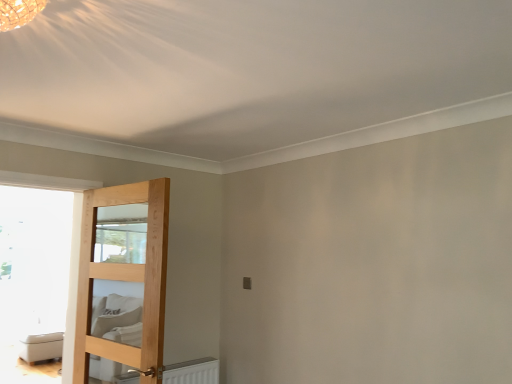
The image size is (512, 384). What are the coordinates of `white leather ottoman at lower left` in the screenshot? It's located at (41, 346).

From the picture: What is the approximate height of white leather ottoman at lower left?

20.52 inches.

Describe the element at coordinates (41, 346) in the screenshot. I see `white leather ottoman at lower left` at that location.

At what (x,y) coordinates should I click in order to perform the action: click on natural wood door at left. Please return your answer as a coordinate pair (x, y). Looking at the image, I should click on (122, 282).

This screenshot has width=512, height=384. What do you see at coordinates (122, 282) in the screenshot?
I see `natural wood door at left` at bounding box center [122, 282].

Identify the location of white leather ottoman at lower left. The width and height of the screenshot is (512, 384). (41, 346).

Is natural wood door at left to the left or to the right of white leather ottoman at lower left in the image?

Clearly, natural wood door at left is on the right of white leather ottoman at lower left in the image.

Which is behind, natural wood door at left or white leather ottoman at lower left?

Positioned behind is white leather ottoman at lower left.

Is point (156, 320) closer to viewer compared to point (57, 355)?

Yes, it is.

From the image's perspective, does natural wood door at left appear higher than white leather ottoman at lower left?

Correct, natural wood door at left appears higher than white leather ottoman at lower left in the image.

From a real-world perspective, is natural wood door at left physically above white leather ottoman at lower left?

Yes, from a real-world perspective, natural wood door at left is on top of white leather ottoman at lower left.

Is natural wood door at left wider or thinner than white leather ottoman at lower left?

In the image, natural wood door at left appears to be more narrow than white leather ottoman at lower left.

Considering the sizes of objects natural wood door at left and white leather ottoman at lower left in the image provided, who is shorter, natural wood door at left or white leather ottoman at lower left?

With less height is white leather ottoman at lower left.

Is natural wood door at left bigger than white leather ottoman at lower left?

No.

Would you say white leather ottoman at lower left is part of natural wood door at left's contents?

No.

Is there a large distance between natural wood door at left and white leather ottoman at lower left?

That's right, there is a large distance between natural wood door at left and white leather ottoman at lower left.

Is white leather ottoman at lower left at the back of natural wood door at left?

natural wood door at left does not have its back to white leather ottoman at lower left.

Looking at this image, can you tell me how much natural wood door at left and white leather ottoman at lower left differ in facing direction?

The angle between the facing direction of natural wood door at left and the facing direction of white leather ottoman at lower left is 79.4 degrees.

This screenshot has height=384, width=512. Find the location of `furniture on the left of natural wood door at left`. furniture on the left of natural wood door at left is located at coordinates (41, 346).

Considering the positions of objects white leather ottoman at lower left and natural wood door at left in the image provided, who is more to the right, white leather ottoman at lower left or natural wood door at left?

natural wood door at left is more to the right.

Which object is more forward, white leather ottoman at lower left or natural wood door at left?

natural wood door at left is in front.

Is point (60, 340) closer or farther from the camera than point (141, 250)?

Point (60, 340).

From the image's perspective, would you say white leather ottoman at lower left is shown under natural wood door at left?

Yes.

From a real-world perspective, who is located higher, white leather ottoman at lower left or natural wood door at left?

From a 3D spatial view, natural wood door at left is above.

Is white leather ottoman at lower left thinner than natural wood door at left?

No.

Which of these two, white leather ottoman at lower left or natural wood door at left, stands shorter?

white leather ottoman at lower left.

Considering the sizes of objects white leather ottoman at lower left and natural wood door at left in the image provided, who is smaller, white leather ottoman at lower left or natural wood door at left?

natural wood door at left.

Is white leather ottoman at lower left situated inside natural wood door at left or outside?

white leather ottoman at lower left lies outside natural wood door at left.

Are white leather ottoman at lower left and natural wood door at left located far from each other?

Yes, white leather ottoman at lower left and natural wood door at left are quite far apart.

In the scene shown: Is white leather ottoman at lower left looking in the opposite direction of natural wood door at left?

No, natural wood door at left is not at the back of white leather ottoman at lower left.

Can you tell me how much white leather ottoman at lower left and natural wood door at left differ in facing direction?

79.4 degrees.

Measure the distance between white leather ottoman at lower left and natural wood door at left.

1.31 meters.

The height and width of the screenshot is (384, 512). Identify the location of door in front of the white leather ottoman at lower left. (122, 282).

At what (x,y) coordinates should I click in order to perform the action: click on door on the right of white leather ottoman at lower left. Please return your answer as a coordinate pair (x, y). The height and width of the screenshot is (384, 512). Looking at the image, I should click on (122, 282).

At what (x,y) coordinates should I click in order to perform the action: click on door in front of the white leather ottoman at lower left. Please return your answer as a coordinate pair (x, y). The height and width of the screenshot is (384, 512). Looking at the image, I should click on (122, 282).